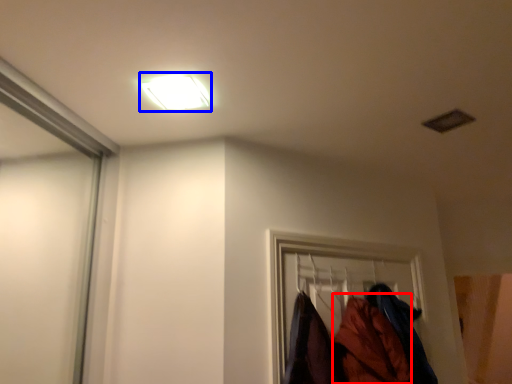
Question: Which object is further to the camera taking this photo, clothing (highlighted by a red box) or lamp (highlighted by a blue box)?

Choices:
 (A) clothing
 (B) lamp

Answer: (A)